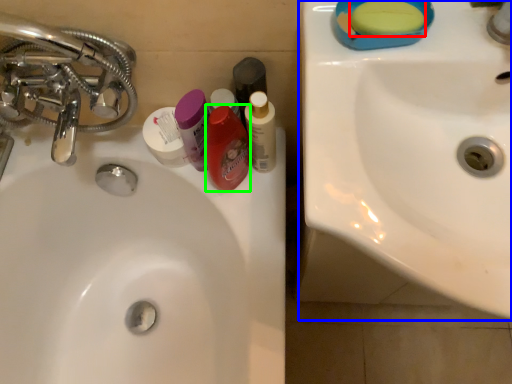
Question: Considering the real-world distances, which object is closest to soap (highlighted by a red box)? sink (highlighted by a blue box) or mouthwash (highlighted by a green box).

Choices:
 (A) sink
 (B) mouthwash

Answer: (A)